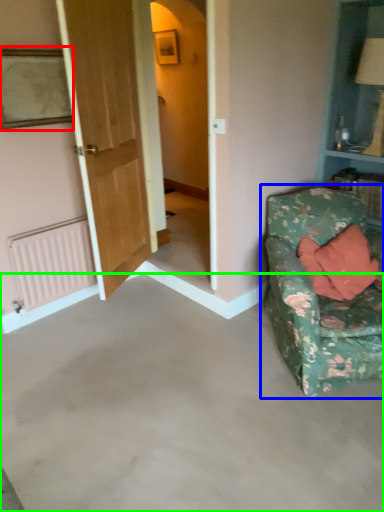
Question: Estimate the real-world distances between objects in this image. Which object is farther from picture frame (highlighted by a red box), studio couch (highlighted by a blue box) or concrete (highlighted by a green box)?

Choices:
 (A) studio couch
 (B) concrete

Answer: (A)